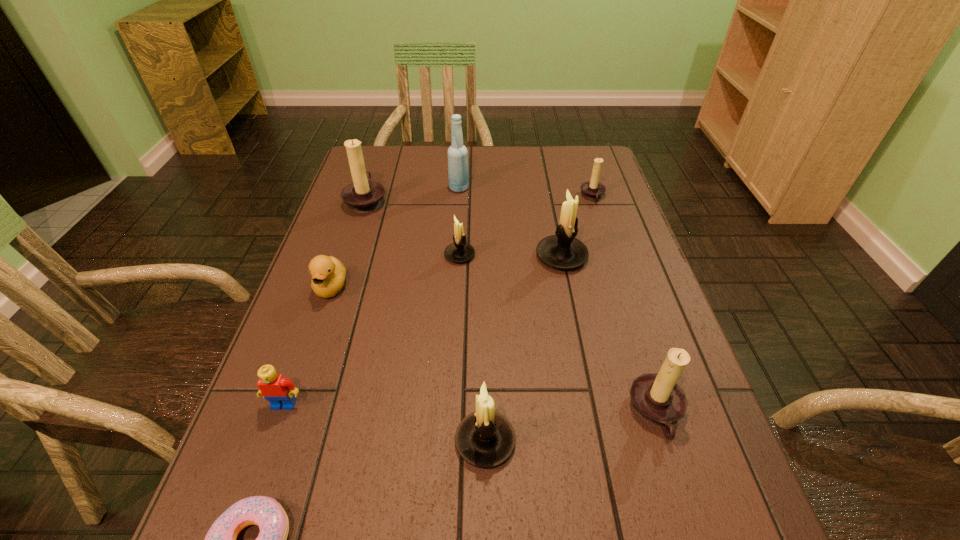
Identify the location of free location located 0.060m on the wick of the smallest brown candle holder. This screenshot has width=960, height=540. (561, 197).

At what (x,y) coordinates should I click in order to perform the action: click on vacant point located on the right of the smallest white candle holder. Please return your answer as a coordinate pair (x, y). Looking at the image, I should click on (545, 255).

Find the location of a particular element. This screenshot has width=960, height=540. vacant space located on the face of the red Lego is located at coordinates point(261,471).

Locate an element on the screen. vacant area situated 0.130m on the face of the duckling is located at coordinates (309, 352).

This screenshot has width=960, height=540. In order to click on object that is at the far edge in this screenshot , I will do `click(458, 173)`.

In order to click on candle holder at the left edge in this screenshot , I will do `click(364, 195)`.

Where is `Lego that is at the left edge`? This screenshot has width=960, height=540. Lego that is at the left edge is located at coordinates (276, 389).

The width and height of the screenshot is (960, 540). What are the coordinates of `duckling situated at the left edge` in the screenshot? It's located at (328, 273).

This screenshot has height=540, width=960. In the image, there is a desktop. In order to click on vacant space at the far edge in this screenshot , I will do `click(469, 169)`.

Where is `free space at the near edge of the desktop`? free space at the near edge of the desktop is located at coordinates click(553, 538).